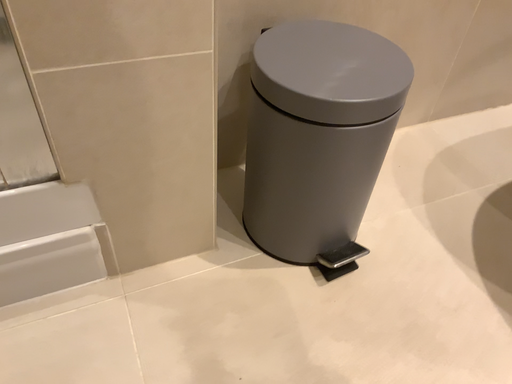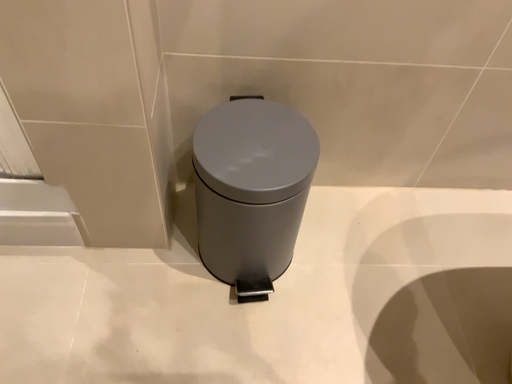
Question: Which way did the camera rotate in the video?

Choices:
 (A) rotated right
 (B) rotated left

Answer: (B)